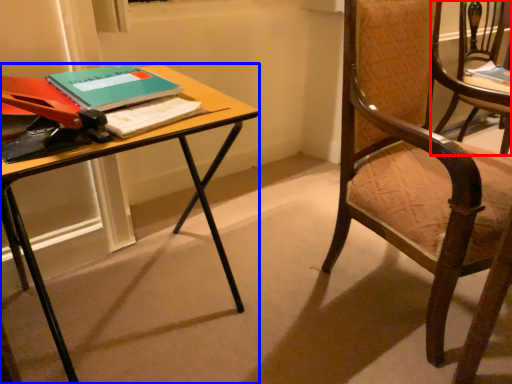
Question: Which object appears farthest to the camera in this image, chair (highlighted by a red box) or desk (highlighted by a blue box)?

Choices:
 (A) chair
 (B) desk

Answer: (A)